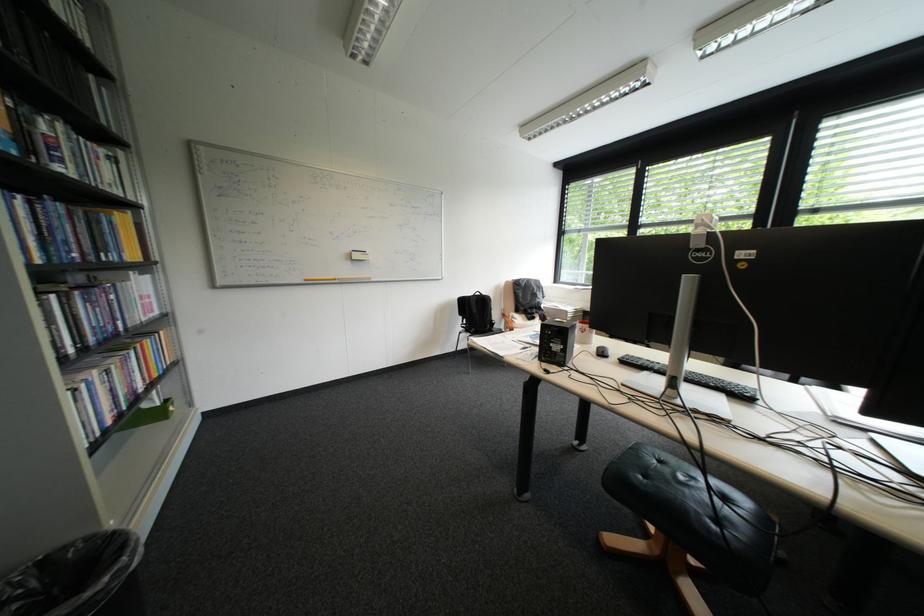
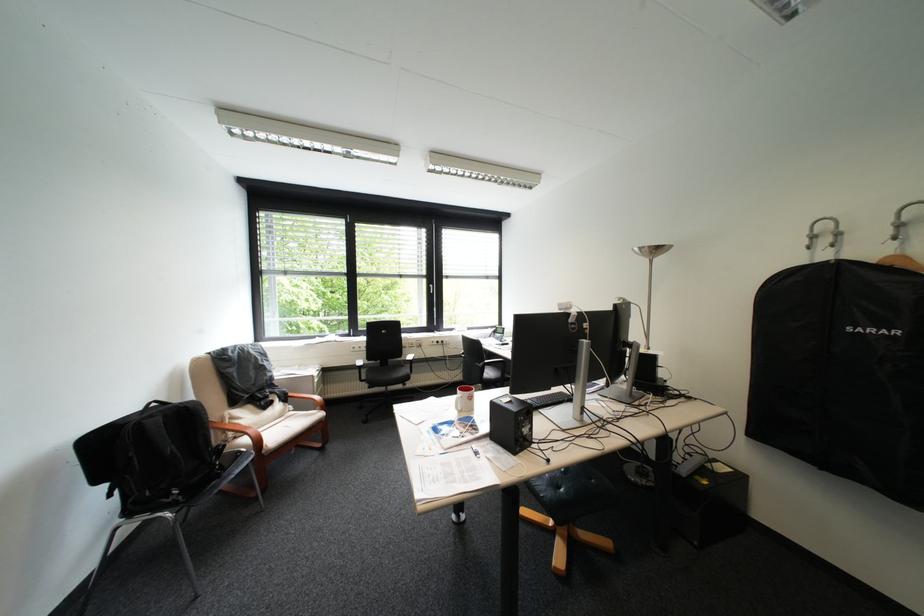
In the second image, find the point that corresponds to (505,322) in the first image.

(231, 445)